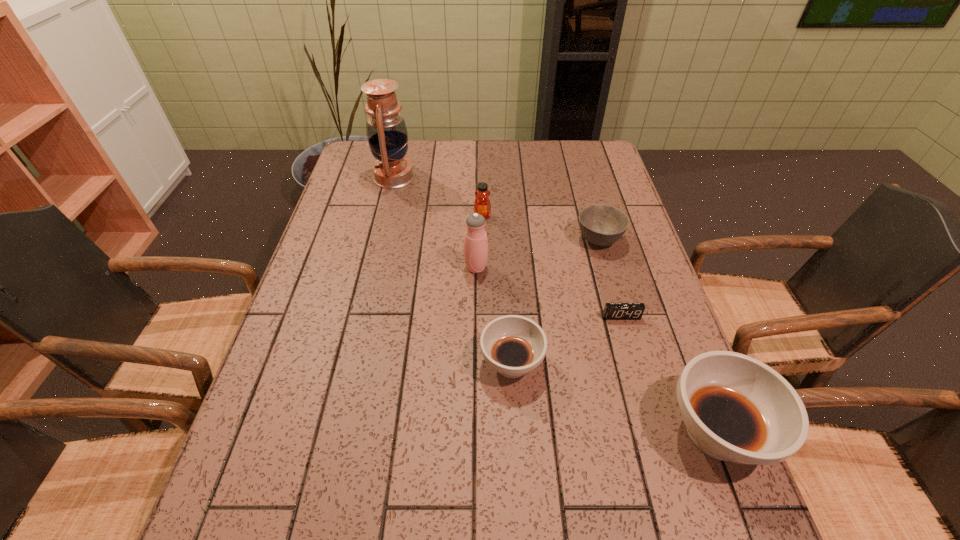
Find the location of a particular element. Image resolution: width=960 pixels, height=540 pixels. unoccupied area between the taller soup bowl and the third nearest object is located at coordinates (669, 374).

Find the location of a particular element. The width and height of the screenshot is (960, 540). object that can be found as the third closest to the tallest object is located at coordinates (601, 225).

What are the coordinates of `object that is the fifth closest one to the left soup bowl` in the screenshot? It's located at (482, 205).

This screenshot has height=540, width=960. Identify the location of vacant area that satisfies the following two spatial constraints: 1. on the front label of the honey; 2. on the left side of the bowl. (483, 240).

Where is `vacant space that satisfies the following two spatial constraints: 1. on the front label of the right soup bowl; 2. on the left side of the second farthest object`? vacant space that satisfies the following two spatial constraints: 1. on the front label of the right soup bowl; 2. on the left side of the second farthest object is located at coordinates (484, 431).

Find the location of a particular element. vacant area that satisfies the following two spatial constraints: 1. on the front label of the right soup bowl; 2. on the right side of the honey is located at coordinates (484, 431).

This screenshot has width=960, height=540. Find the location of `vacant space that satisfies the following two spatial constraints: 1. on the front label of the shorter soup bowl; 2. on the left side of the sixth nearest object`. vacant space that satisfies the following two spatial constraints: 1. on the front label of the shorter soup bowl; 2. on the left side of the sixth nearest object is located at coordinates 483,363.